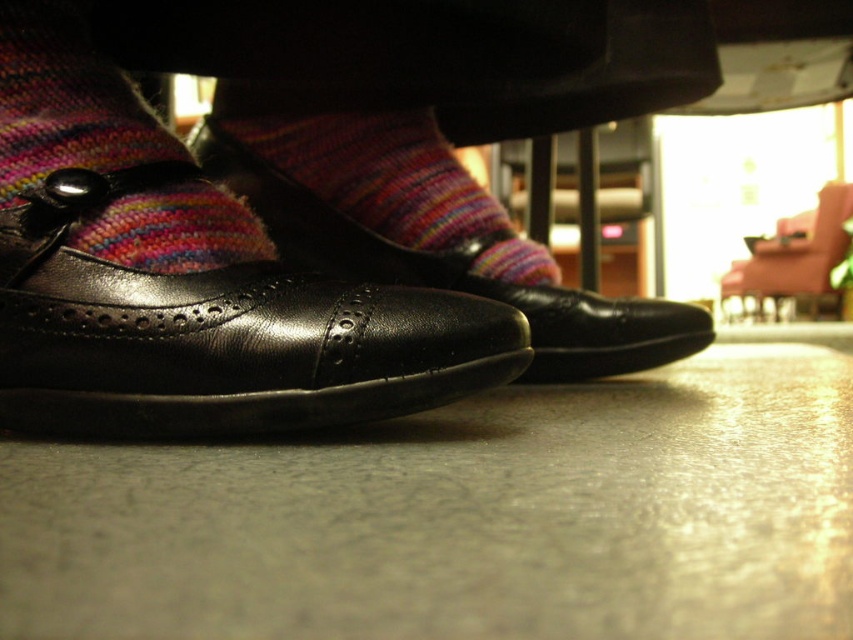
You are a photographer setting up a shoot in this room. You want to ensure the multicolored knitted sock at center and the leather armchair at lower right are both visible in the frame. Given their positions, which object should you adjust to achieve this?

The multicolored knitted sock at center is positioned under the leather armchair at lower right. To ensure both are visible, you should adjust the leather armchair at lower right to move it away from the sock so that it no longer blocks the view of the sock.

From the picture: You are organizing a small party and need to arrange seating. You have a multicolored knitted sock at center and a leather armchair at lower right. Which object is narrower and can fit better in a tight space?

The multicolored knitted sock at center has a lesser width compared to the leather armchair at lower right, so it can fit better in a tight space.

You are taking a photo of the feet and want to focus on both point (x=444, y=140) and point (x=521, y=300). Which point is closer to the camera lens?

Point (x=444, y=140) is closer to the camera lens than point (x=521, y=300) because it is further to the camera.